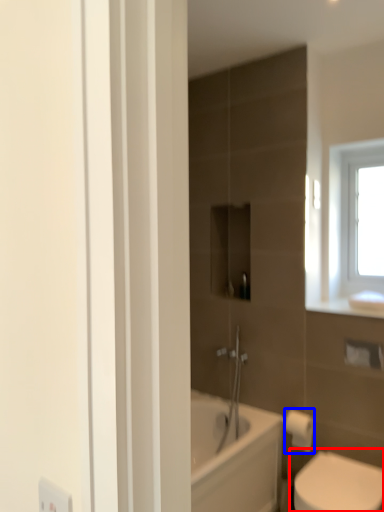
Question: Which object appears farthest to the camera in this image, toilet (highlighted by a red box) or toilet paper (highlighted by a blue box)?

Choices:
 (A) toilet
 (B) toilet paper

Answer: (B)